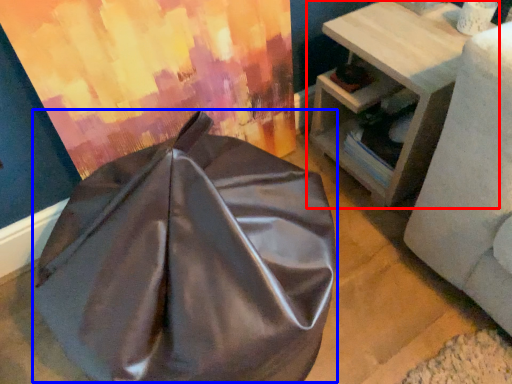
Question: Which object is closer to the camera taking this photo, table (highlighted by a red box) or bean bag chair (highlighted by a blue box)?

Choices:
 (A) table
 (B) bean bag chair

Answer: (B)